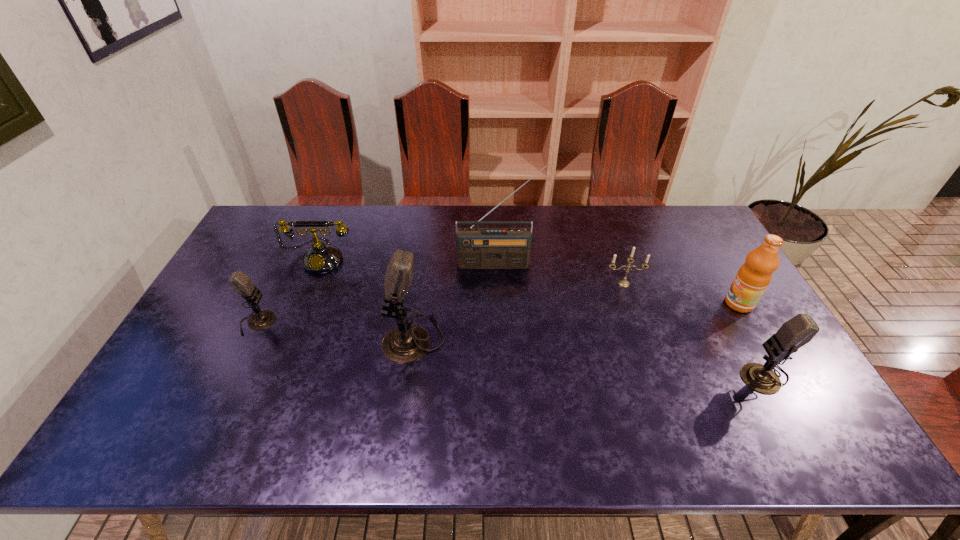
The height and width of the screenshot is (540, 960). In order to click on the leftmost microphone in this screenshot , I will do `click(241, 283)`.

Locate an element on the screen. The width and height of the screenshot is (960, 540). the fifth object from right to left is located at coordinates (406, 343).

This screenshot has height=540, width=960. Identify the location of the tallest microphone. (406, 343).

Identify the location of the rightmost microphone. The image size is (960, 540). 798,331.

Identify the location of telephone. (321, 258).

Identify the location of candle. (624, 283).

In order to click on the third farthest object in this screenshot , I will do `click(624, 283)`.

Find the location of a particular element. The height and width of the screenshot is (540, 960). the fourth object from left to right is located at coordinates (477, 248).

Identify the location of fruit juice. (753, 277).

Where is `vacant space situated on the front-facing side of the shortest microphone`? The width and height of the screenshot is (960, 540). vacant space situated on the front-facing side of the shortest microphone is located at coordinates (393, 323).